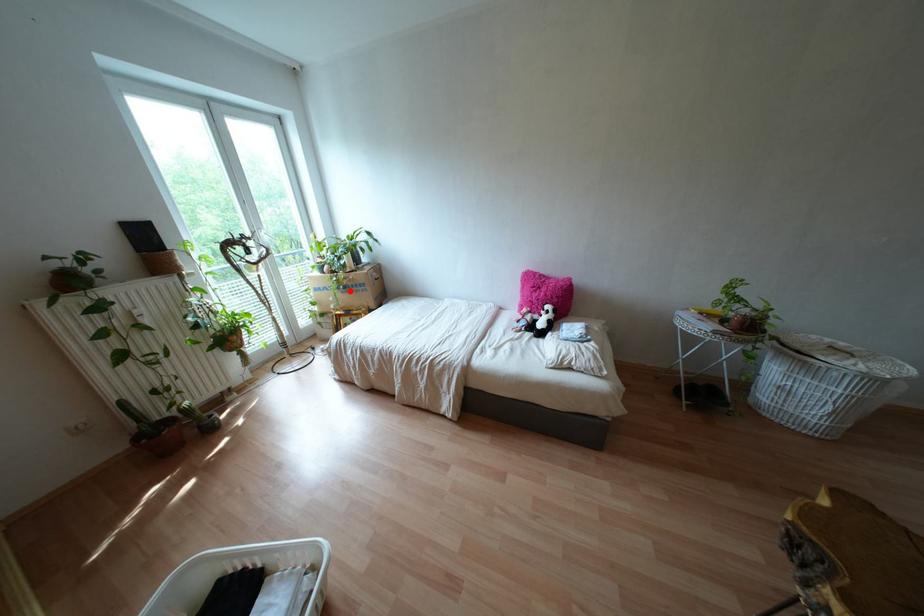
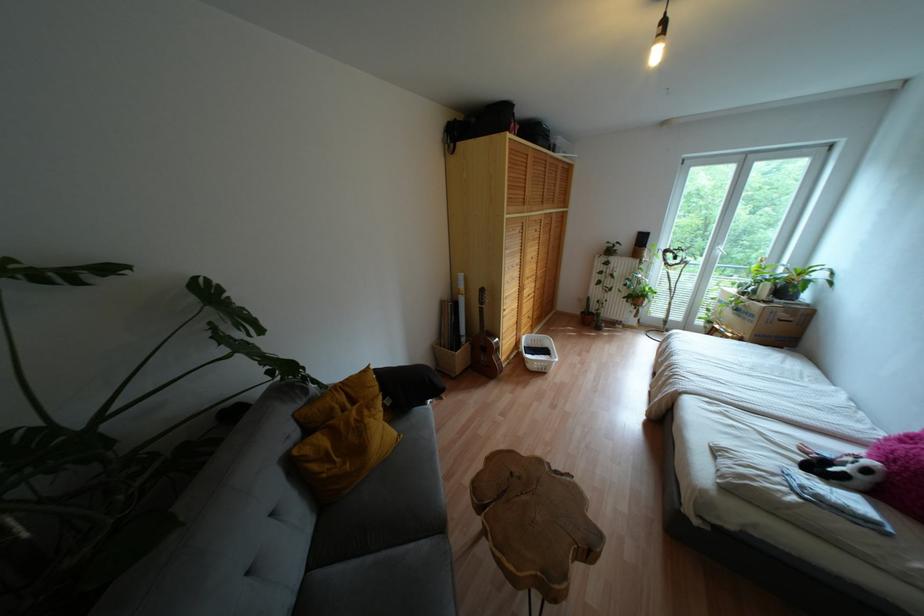
Where in the second image is the point corresponding to the highlighted location from the first image?

(737, 315)